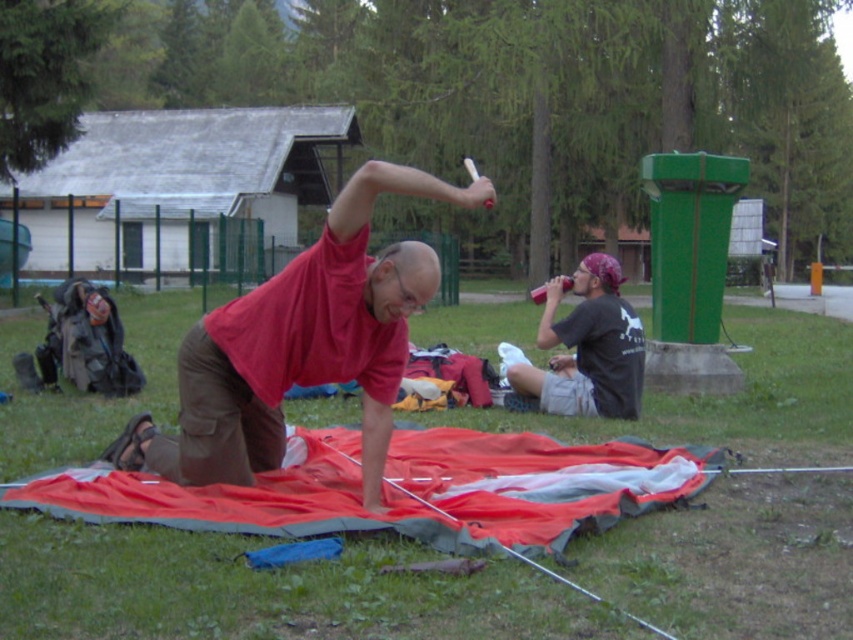
Question: Which point is closer to the camera?

Choices:
 (A) matte black t-shirt at lower right
 (B) green grass at lower center
 (C) matte red shirt at center

Answer: (B)

Question: Which of the following is the farthest from the observer?

Choices:
 (A) matte red shirt at center
 (B) matte black t-shirt at lower right

Answer: (B)

Question: Which object is the closest to the matte black t-shirt at lower right?

Choices:
 (A) matte red shirt at center
 (B) red fabric blanket at center

Answer: (B)

Question: Can you confirm if green grass at lower center is wider than matte red shirt at center?

Choices:
 (A) no
 (B) yes

Answer: (B)

Question: Does red fabric blanket at center appear over matte black t-shirt at lower right?

Choices:
 (A) no
 (B) yes

Answer: (A)

Question: Does red fabric blanket at center appear over matte red shirt at center?

Choices:
 (A) no
 (B) yes

Answer: (A)